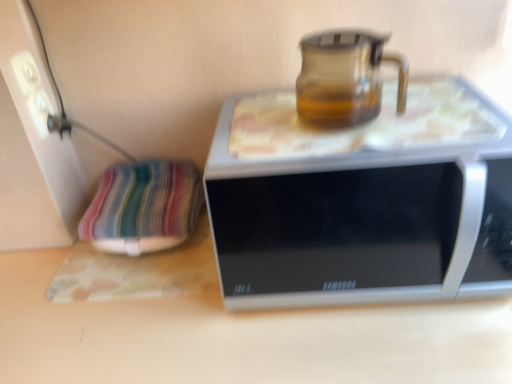
Question: Should I look upward or downward to see transparent glass jug at upper center?

Choices:
 (A) down
 (B) up

Answer: (B)

Question: Is transparent glass jug at upper center far from white plastic socket at upper left?

Choices:
 (A) no
 (B) yes

Answer: (A)

Question: Is transparent glass jug at upper center at the left side of white plastic socket at upper left?

Choices:
 (A) yes
 (B) no

Answer: (B)

Question: Does transparent glass jug at upper center have a greater width compared to white plastic socket at upper left?

Choices:
 (A) no
 (B) yes

Answer: (B)

Question: Does transparent glass jug at upper center have a lesser height compared to white plastic socket at upper left?

Choices:
 (A) yes
 (B) no

Answer: (B)

Question: Can you confirm if transparent glass jug at upper center is smaller than white plastic socket at upper left?

Choices:
 (A) no
 (B) yes

Answer: (A)

Question: Is transparent glass jug at upper center outside of white plastic socket at upper left?

Choices:
 (A) no
 (B) yes

Answer: (B)

Question: From the image's perspective, is white plastic socket at upper left above smooth wooden table at center?

Choices:
 (A) no
 (B) yes

Answer: (B)

Question: From a real-world perspective, is white plastic socket at upper left positioned over smooth wooden table at center based on gravity?

Choices:
 (A) no
 (B) yes

Answer: (B)

Question: Could you tell me if white plastic socket at upper left is facing smooth wooden table at center?

Choices:
 (A) yes
 (B) no

Answer: (B)

Question: Is smooth wooden table at center completely or partially inside white plastic socket at upper left?

Choices:
 (A) yes
 (B) no

Answer: (B)

Question: Is white plastic socket at upper left at the left side of smooth wooden table at center?

Choices:
 (A) no
 (B) yes

Answer: (B)

Question: Is the depth of white plastic socket at upper left less than that of smooth wooden table at center?

Choices:
 (A) yes
 (B) no

Answer: (B)

Question: Is smooth wooden table at center thinner than transparent glass jug at upper center?

Choices:
 (A) no
 (B) yes

Answer: (A)